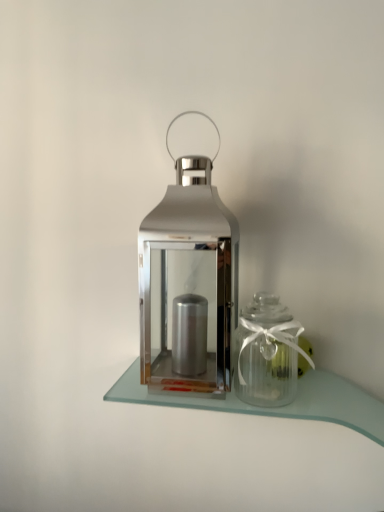
Question: Considering the relative positions of clear glass jar at right and shiny metallic lantern at center in the image provided, is clear glass jar at right to the right of shiny metallic lantern at center from the viewer's perspective?

Choices:
 (A) yes
 (B) no

Answer: (A)

Question: Is clear glass jar at right located outside shiny metallic lantern at center?

Choices:
 (A) no
 (B) yes

Answer: (B)

Question: Can you confirm if clear glass jar at right is wider than shiny metallic lantern at center?

Choices:
 (A) no
 (B) yes

Answer: (A)

Question: Is clear glass jar at right next to shiny metallic lantern at center and touching it?

Choices:
 (A) no
 (B) yes

Answer: (A)

Question: Considering the relative positions of clear glass jar at right and shiny metallic lantern at center in the image provided, is clear glass jar at right to the left of shiny metallic lantern at center from the viewer's perspective?

Choices:
 (A) yes
 (B) no

Answer: (B)

Question: Is point (332, 410) positioned closer to the camera than point (286, 329)?

Choices:
 (A) closer
 (B) farther

Answer: (A)

Question: Is clear glass table at center inside or outside of clear glass jar at right?

Choices:
 (A) inside
 (B) outside

Answer: (B)

Question: Considering the positions of clear glass table at center and clear glass jar at right in the image, is clear glass table at center taller or shorter than clear glass jar at right?

Choices:
 (A) tall
 (B) short

Answer: (B)

Question: Visually, is clear glass table at center positioned to the left or to the right of clear glass jar at right?

Choices:
 (A) left
 (B) right

Answer: (A)

Question: Is point (256, 342) positioned closer to the camera than point (289, 406)?

Choices:
 (A) closer
 (B) farther

Answer: (A)

Question: In terms of width, does clear glass jar at right look wider or thinner when compared to clear glass table at center?

Choices:
 (A) wide
 (B) thin

Answer: (B)

Question: Considering the positions of clear glass jar at right and clear glass table at center in the image, is clear glass jar at right bigger or smaller than clear glass table at center?

Choices:
 (A) small
 (B) big

Answer: (A)

Question: Relative to clear glass table at center, is clear glass jar at right in front or behind?

Choices:
 (A) behind
 (B) front

Answer: (A)

Question: Considering the positions of shiny metallic lantern at center and clear glass table at center in the image, is shiny metallic lantern at center wider or thinner than clear glass table at center?

Choices:
 (A) wide
 (B) thin

Answer: (A)

Question: Visually, is shiny metallic lantern at center positioned to the left or to the right of clear glass table at center?

Choices:
 (A) left
 (B) right

Answer: (A)